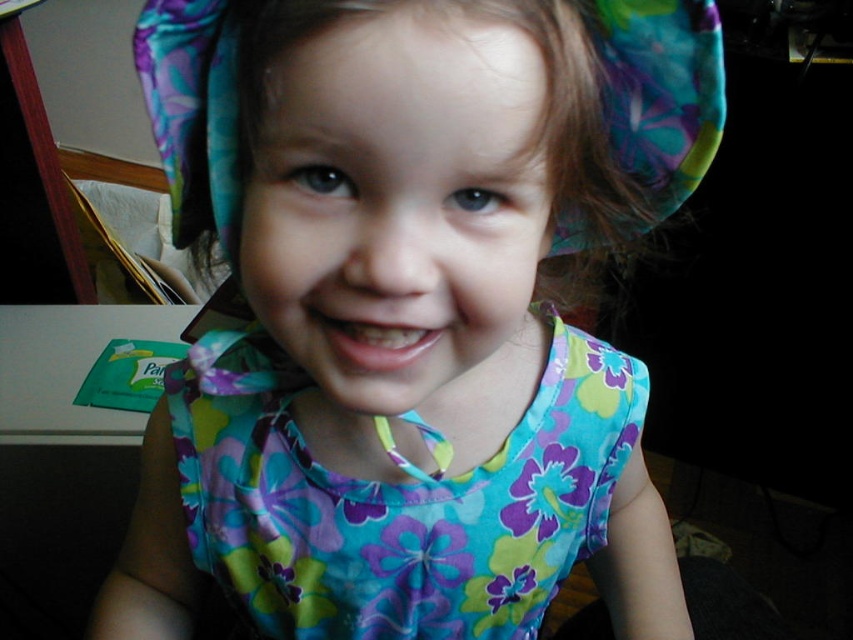
Question: Which of the following is the farthest from the observer?

Choices:
 (A) (184, 196)
 (B) (405, 540)
 (C) (482, 432)
 (D) (445, 241)

Answer: (B)

Question: Which object is positioned farthest from the floral fabric head at center?

Choices:
 (A) floral cotton dress at center
 (B) floral fabric hat at upper center
 (C) floral fabric dress at center

Answer: (A)

Question: Based on their relative distances, which object is nearer to the floral fabric dress at center?

Choices:
 (A) floral cotton dress at center
 (B) floral fabric hat at upper center

Answer: (A)

Question: Is floral fabric dress at center below floral fabric head at center?

Choices:
 (A) no
 (B) yes

Answer: (B)

Question: Is floral fabric dress at center to the left of floral fabric hat at upper center from the viewer's perspective?

Choices:
 (A) yes
 (B) no

Answer: (A)

Question: Does floral fabric head at center have a larger size compared to floral cotton dress at center?

Choices:
 (A) yes
 (B) no

Answer: (B)